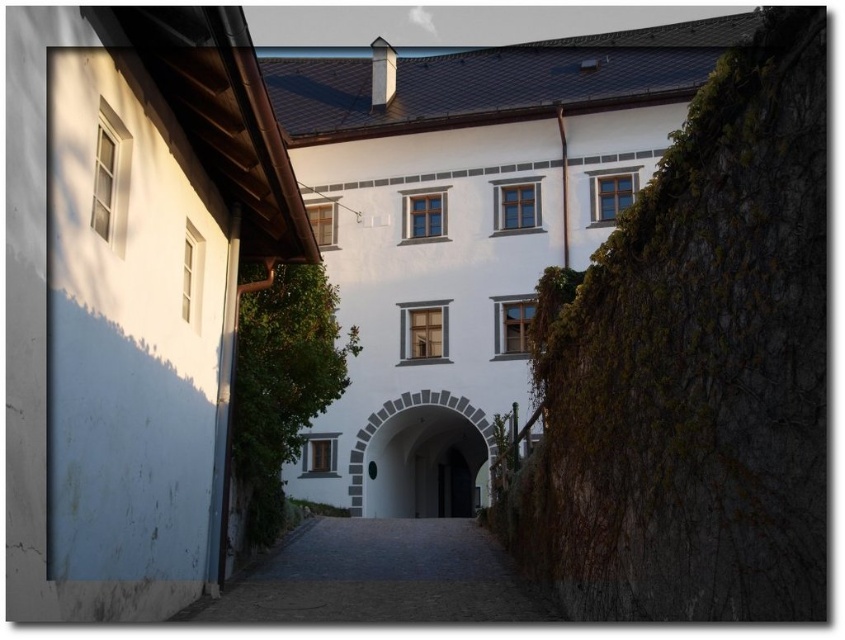
You are standing in front of the castle entrance and see the dark stone path at center and the dark wood door at center. Which object is located to the left of the other?

The dark stone path at center is positioned on the left side of dark wood door at center, so the dark stone path at center is to the left of the dark wood door at center.